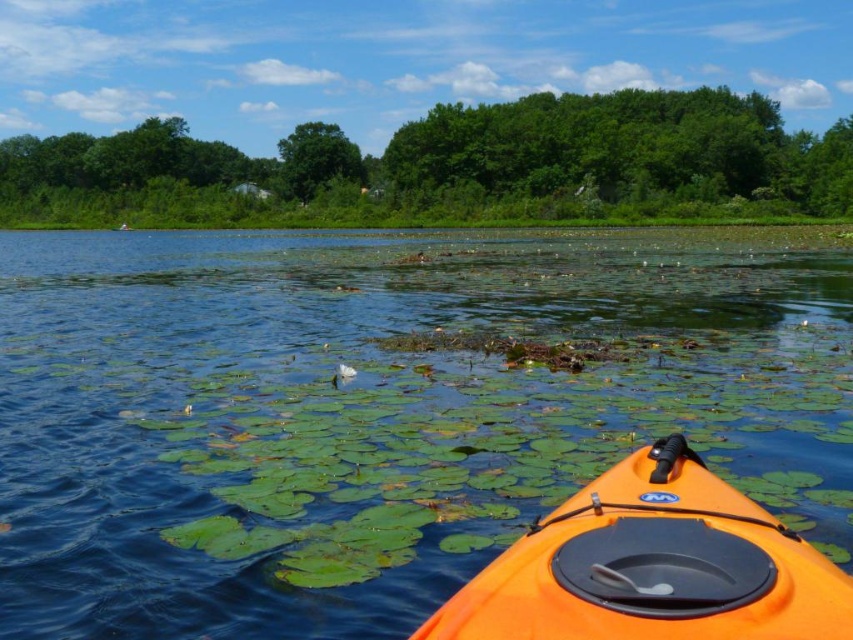
You are standing at the bottom left corner of the image and want to reach the transparent water at center. Which direction should you move first?

You should move towards the right and upward direction to reach the transparent water at center, as its 2D location is at point (x=376, y=413).

You are standing at the edge of the lake and see two points in the water. The first point is at coordinate point (517, 314) and the second is at point (728, 604). Which point is closer to you?

Point (517, 314) is closer to you because it is further to the camera than point (728, 604).